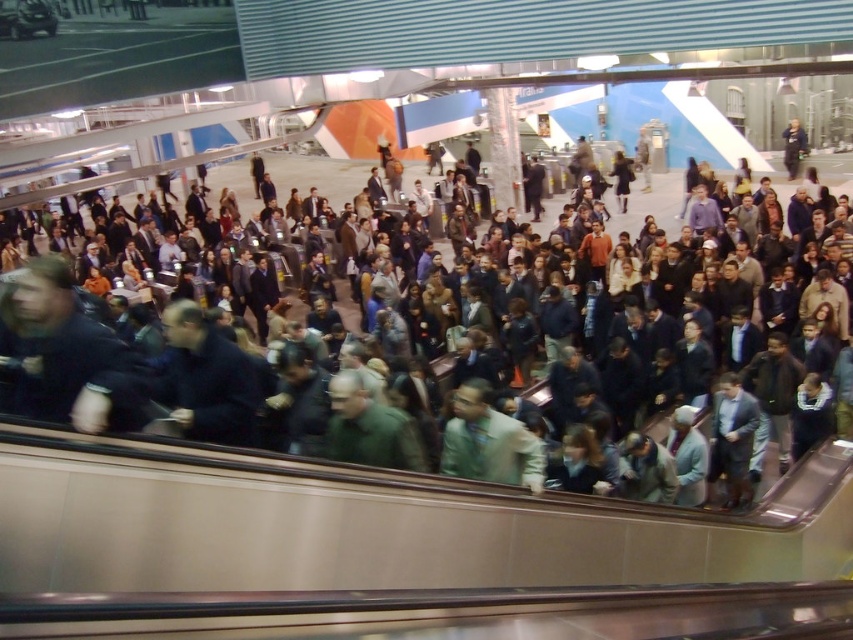
Is light beige fabric shirt at center further to the viewer compared to dark gray jacket at center?

No, light beige fabric shirt at center is closer to the viewer.

Who is positioned more to the left, light beige fabric shirt at center or dark gray jacket at center?

Positioned to the left is dark gray jacket at center.

Where is `light beige fabric shirt at center`? light beige fabric shirt at center is located at coordinates (489, 442).

This screenshot has width=853, height=640. Identify the location of light beige fabric shirt at center. (489, 442).